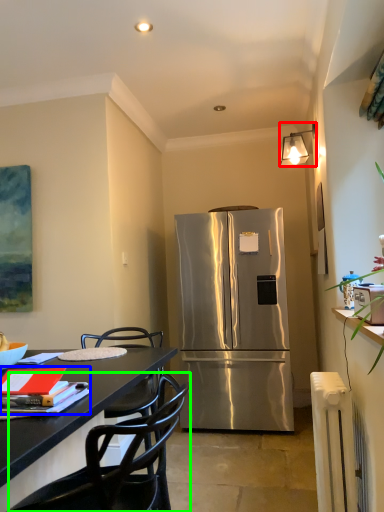
Question: Estimate the real-world distances between objects in this image. Which object is closer to lamp (highlighted by a red box), book (highlighted by a blue box) or chair (highlighted by a green box)?

Choices:
 (A) book
 (B) chair

Answer: (A)